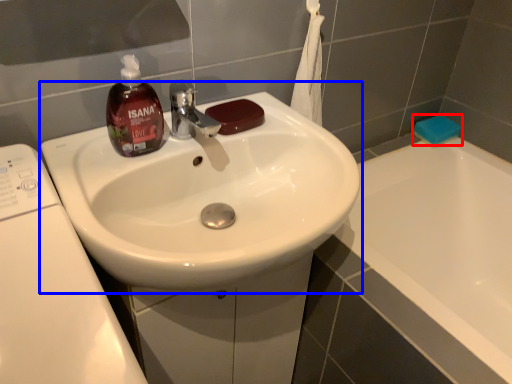
Question: Among these objects, which one is farthest to the camera, soap (highlighted by a red box) or sink (highlighted by a blue box)?

Choices:
 (A) soap
 (B) sink

Answer: (A)